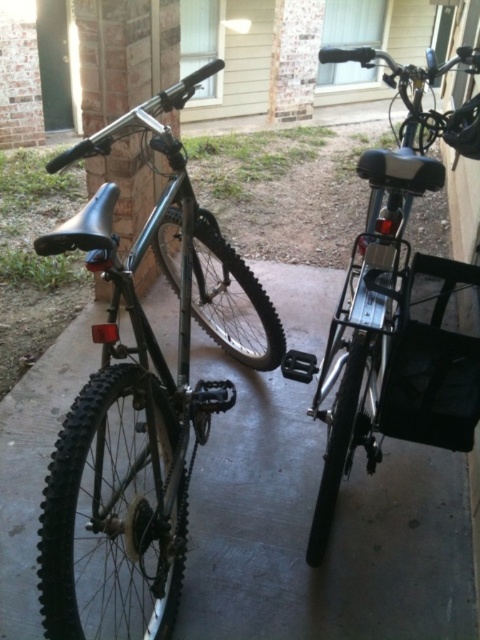
Can you confirm if matte black bicycle at left is positioned to the right of metallic silver bicycle at right?

Incorrect, matte black bicycle at left is not on the right side of metallic silver bicycle at right.

Find the location of a particular element. matte black bicycle at left is located at coordinates (135, 406).

Locate an element on the screen. The height and width of the screenshot is (640, 480). matte black bicycle at left is located at coordinates (135, 406).

Is matte black bicycle at center taller than matte black bicycle at left?

In fact, matte black bicycle at center may be shorter than matte black bicycle at left.

Describe the element at coordinates (309, 529) in the screenshot. I see `matte black bicycle at center` at that location.

Does point (340, 620) come behind point (110, 588)?

That is False.

The width and height of the screenshot is (480, 640). Find the location of `matte black bicycle at center`. matte black bicycle at center is located at coordinates (309, 529).

Is matte black bicycle at center behind metallic silver bicycle at right?

Yes.

Is point (228, 515) positioned after point (371, 289)?

Yes.

Which is behind, point (222, 422) or point (346, 323)?

The point (222, 422) is more distant.

The image size is (480, 640). Find the location of `matte black bicycle at center`. matte black bicycle at center is located at coordinates (309, 529).